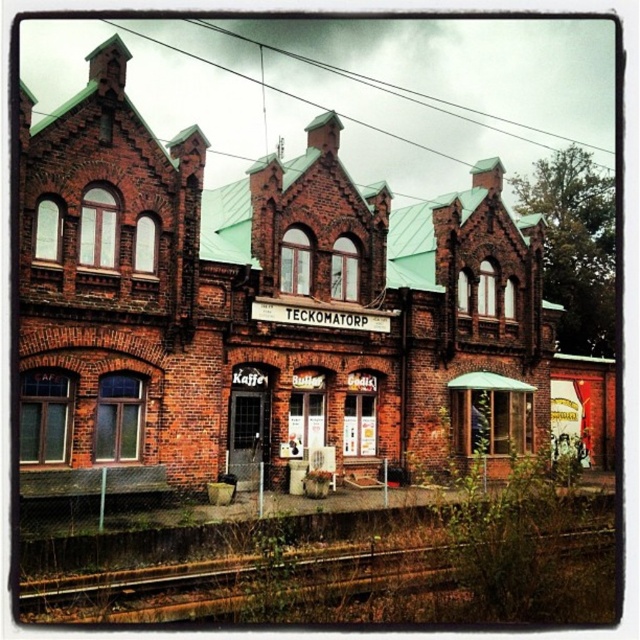
Question: Is brick building at center smaller than rusty metal train track at lower left?

Choices:
 (A) no
 (B) yes

Answer: (A)

Question: Among these objects, which one is nearest to the camera?

Choices:
 (A) rusty metal train track at lower left
 (B) brick building at center

Answer: (A)

Question: Which point appears farthest from the camera in this image?

Choices:
 (A) (76, 582)
 (B) (598, 468)

Answer: (B)

Question: Does brick building at center have a smaller size compared to rusty metal train track at lower left?

Choices:
 (A) no
 (B) yes

Answer: (A)

Question: In this image, where is brick building at center located relative to rusty metal train track at lower left?

Choices:
 (A) below
 (B) above

Answer: (B)